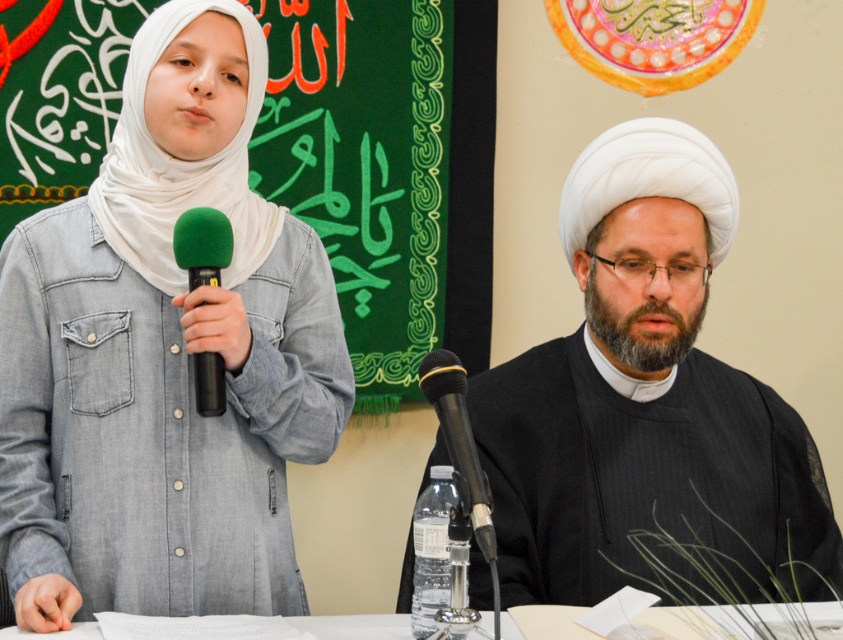
Question: Estimate the real-world distances between objects in this image. Which object is farther from the white glossy table at lower center?

Choices:
 (A) black matte microphone at center
 (B) white matte headscarf at left
 (C) green matte microphone at left
 (D) black matte turban at center

Answer: (B)

Question: Which point is farther from the camera taking this photo?

Choices:
 (A) (329, 628)
 (B) (629, 253)
 (C) (115, 252)

Answer: (C)

Question: Can you confirm if black matte microphone at center is bigger than green matte microphone at left?

Choices:
 (A) yes
 (B) no

Answer: (A)

Question: Considering the relative positions of black matte turban at center and green fabric poster at upper left in the image provided, where is black matte turban at center located with respect to green fabric poster at upper left?

Choices:
 (A) above
 (B) below

Answer: (B)

Question: Which of the following is the closest to the observer?

Choices:
 (A) white glossy table at lower center
 (B) white matte headscarf at left
 (C) green matte microphone at left
 (D) black matte microphone at center

Answer: (D)

Question: Can you confirm if white matte headscarf at left is positioned to the left of black matte microphone at center?

Choices:
 (A) no
 (B) yes

Answer: (B)